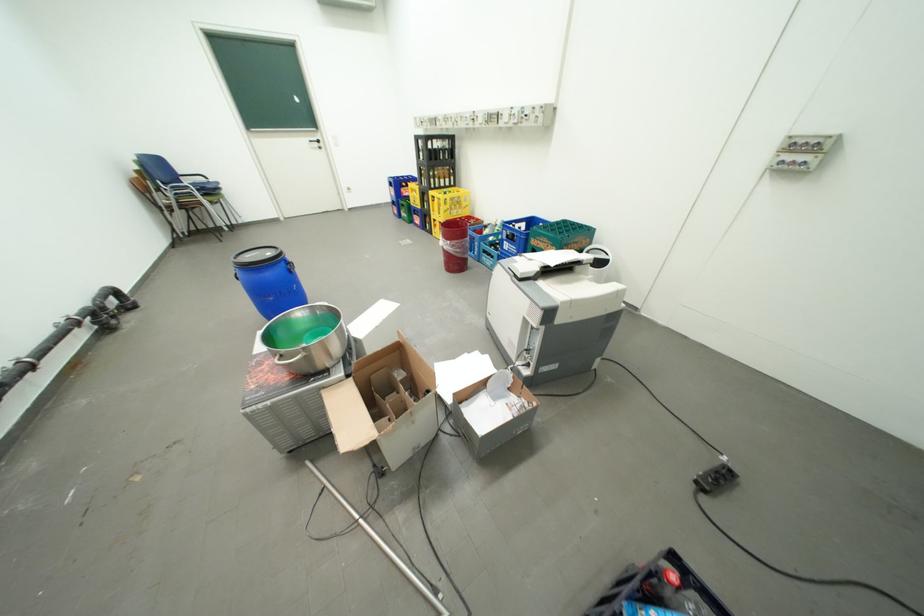
You are a GUI agent. You are given a task and a screenshot of the screen. Output one action in this format:
    pyautogui.click(x=<x>, y=<y>)
    Task: Click on the metal pole
    The height and width of the screenshot is (616, 924).
    Given the screenshot: What is the action you would take?
    pyautogui.click(x=380, y=541)